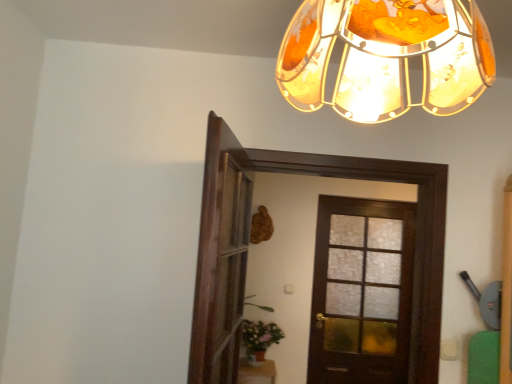
Where is `wooden screen door at center`? This screenshot has width=512, height=384. wooden screen door at center is located at coordinates (228, 275).

Measure the distance between dark wood door at center, marked as the second door in a back-to-front arrangement, and camera.

The depth of dark wood door at center, marked as the second door in a back-to-front arrangement, is 3.63 feet.

This screenshot has width=512, height=384. In order to click on wooden screen door at center in this screenshot , I will do `click(228, 275)`.

Image resolution: width=512 pixels, height=384 pixels. I want to click on screen door on the left of dark wood door at center, which is counted as the 1th door, starting from the front, so click(x=228, y=275).

Which of these two, dark wood door at center, which is counted as the 1th door, starting from the front, or wooden screen door at center, stands taller?

With more height is dark wood door at center, which is counted as the 1th door, starting from the front.

Is translucent amber glass lampshade at upper center outside of wooden screen door at center?

translucent amber glass lampshade at upper center is positioned outside wooden screen door at center.

Does translucent amber glass lampshade at upper center touch wooden screen door at center?

No, translucent amber glass lampshade at upper center is not touching wooden screen door at center.

Which point is more distant from viewer, (288, 62) or (222, 335)?

Point (222, 335)

Considering the sizes of objects translucent amber glass lampshade at upper center and wooden screen door at center in the image provided, who is thinner, translucent amber glass lampshade at upper center or wooden screen door at center?

wooden screen door at center is thinner.

Can you confirm if translucent amber glass lampshade at upper center is smaller than dark wood door at center, marked as the second door in a back-to-front arrangement?

Indeed, translucent amber glass lampshade at upper center has a smaller size compared to dark wood door at center, marked as the second door in a back-to-front arrangement.

Is translucent amber glass lampshade at upper center looking in the opposite direction of dark wood door at center, which is counted as the 1th door, starting from the front?

No, translucent amber glass lampshade at upper center is not facing the opposite direction of dark wood door at center, which is counted as the 1th door, starting from the front.

Where is `the 1st door behind the translucent amber glass lampshade at upper center, counting from the anchor's position`? the 1st door behind the translucent amber glass lampshade at upper center, counting from the anchor's position is located at coordinates pos(246,252).

Which of these two, translucent amber glass lampshade at upper center or dark wood door at center, marked as the second door in a back-to-front arrangement, is wider?

With larger width is translucent amber glass lampshade at upper center.

Which is behind, green matte plant at lower center or translucent amber glass lampshade at upper center?

green matte plant at lower center.

This screenshot has width=512, height=384. Identify the location of plant below the translucent amber glass lampshade at upper center (from the image's perspective). (260, 335).

How far apart are green matte plant at lower center and translucent amber glass lampshade at upper center?

green matte plant at lower center and translucent amber glass lampshade at upper center are 8.63 feet apart from each other.

Considering the relative positions of green matte plant at lower center and translucent amber glass lampshade at upper center in the image provided, is green matte plant at lower center to the left of translucent amber glass lampshade at upper center from the viewer's perspective?

Yes, green matte plant at lower center is to the left of translucent amber glass lampshade at upper center.

Between wooden screen door at center and green matte plant at lower center, which one has smaller width?

Thinner between the two is wooden screen door at center.

Is wooden screen door at center looking in the opposite direction of green matte plant at lower center?

No, wooden screen door at center is not facing the opposite direction of green matte plant at lower center.

Is wooden screen door at center not within green matte plant at lower center?

Yes.

Is wooden screen door at center taller or shorter than green matte plant at lower center?

In the image, wooden screen door at center appears to be taller than green matte plant at lower center.

Considering the positions of point (451, 42) and point (266, 326), is point (451, 42) closer or farther from the camera than point (266, 326)?

Point (451, 42) appears to be closer to the viewer than point (266, 326).

Is translucent amber glass lampshade at upper center wider or thinner than green matte plant at lower center?

translucent amber glass lampshade at upper center is thinner than green matte plant at lower center.

Is translucent amber glass lampshade at upper center looking in the opposite direction of green matte plant at lower center?

That's not correct — translucent amber glass lampshade at upper center is not looking away from green matte plant at lower center.

From the image's perspective, count 2nd doors downward from the wooden screen door at center and point to it. Please provide its 2D coordinates.

[(361, 291)]

Is wooden screen door at center positioned behind dark wood door at center, the 2th door in the front-to-back sequence?

No, wooden screen door at center is closer to the viewer.

Is wooden screen door at center with dark wood door at center, which is the first door from back to front?

There is a gap between wooden screen door at center and dark wood door at center, which is the first door from back to front.

Could you measure the distance between wooden screen door at center and dark wood door at center, the 2th door in the front-to-back sequence?

wooden screen door at center and dark wood door at center, the 2th door in the front-to-back sequence, are 1.84 meters apart.

Identify the location of the 1st door to the right of the wooden screen door at center, starting your count from the anchor. This screenshot has height=384, width=512. (246, 252).

You are a GUI agent. You are given a task and a screenshot of the screen. Output one action in this format:
    pyautogui.click(x=<x>, y=<y>)
    Task: Click on the screen door behind the translucent amber glass lampshade at upper center
    The height and width of the screenshot is (384, 512).
    Given the screenshot: What is the action you would take?
    pyautogui.click(x=228, y=275)

Looking at the image, which one is located closer to dark wood door at center, which is the first door from back to front, translucent amber glass lampshade at upper center or dark wood door at center, which is counted as the 1th door, starting from the front?

dark wood door at center, which is counted as the 1th door, starting from the front, is positioned closer to the anchor dark wood door at center, which is the first door from back to front.

Which object lies nearer to the anchor point wooden screen door at center, dark wood door at center, which is the first door from back to front, or dark wood door at center, which is counted as the 1th door, starting from the front?

The object closer to wooden screen door at center is dark wood door at center, which is counted as the 1th door, starting from the front.

Considering their positions, is dark wood door at center, the 2th door in the front-to-back sequence, positioned further to wooden screen door at center than green matte plant at lower center?

dark wood door at center, the 2th door in the front-to-back sequence, is further to wooden screen door at center.

Estimate the real-world distances between objects in this image. Which object is further from dark wood door at center, marked as the second door in a back-to-front arrangement, translucent amber glass lampshade at upper center or wooden screen door at center?

The object further to dark wood door at center, marked as the second door in a back-to-front arrangement, is translucent amber glass lampshade at upper center.

When comparing their distances from translucent amber glass lampshade at upper center, does dark wood door at center, marked as the second door in a back-to-front arrangement, or dark wood door at center, which is the first door from back to front, seem closer?

The object closer to translucent amber glass lampshade at upper center is dark wood door at center, marked as the second door in a back-to-front arrangement.

From the picture: Considering their positions, is green matte plant at lower center positioned closer to dark wood door at center, marked as the second door in a back-to-front arrangement, than wooden screen door at center?

wooden screen door at center lies closer to dark wood door at center, marked as the second door in a back-to-front arrangement, than the other object.

Based on their spatial positions, is dark wood door at center, which is counted as the 1th door, starting from the front, or wooden screen door at center further from translucent amber glass lampshade at upper center?

Based on the image, wooden screen door at center appears to be further to translucent amber glass lampshade at upper center.

In the scene shown: Looking at the image, which one is located further to wooden screen door at center, green matte plant at lower center or dark wood door at center, the 2th door in the front-to-back sequence?

Among the two, dark wood door at center, the 2th door in the front-to-back sequence, is located further to wooden screen door at center.

Where is `door located between translucent amber glass lampshade at upper center and green matte plant at lower center in the depth direction`? The image size is (512, 384). door located between translucent amber glass lampshade at upper center and green matte plant at lower center in the depth direction is located at coordinates (246, 252).

Image resolution: width=512 pixels, height=384 pixels. In order to click on screen door between translucent amber glass lampshade at upper center and dark wood door at center, marked as the second door in a back-to-front arrangement, along the z-axis in this screenshot , I will do `click(228, 275)`.

The width and height of the screenshot is (512, 384). In order to click on screen door between translucent amber glass lampshade at upper center and green matte plant at lower center from front to back in this screenshot , I will do `click(228, 275)`.

Where is `door between translucent amber glass lampshade at upper center and dark wood door at center, which is the first door from back to front, along the z-axis`? The width and height of the screenshot is (512, 384). door between translucent amber glass lampshade at upper center and dark wood door at center, which is the first door from back to front, along the z-axis is located at coordinates (246, 252).